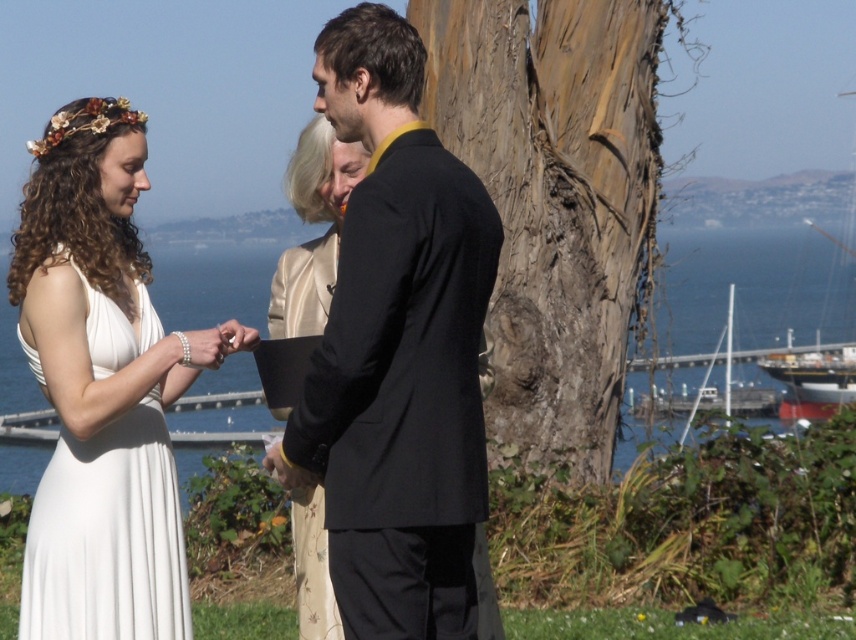
Is white satin dress at left to the right of silky beige dress at center from the viewer's perspective?

No, white satin dress at left is not to the right of silky beige dress at center.

Who is lower down, white satin dress at left or silky beige dress at center?

white satin dress at left is below.

Is point (140, 529) more distant than point (334, 227)?

No, it is in front of (334, 227).

Find the location of a particular element. Image resolution: width=856 pixels, height=640 pixels. white satin dress at left is located at coordinates (107, 536).

Which is in front, point (229, 282) or point (138, 496)?

Positioned in front is point (138, 496).

Which is below, blue water at center or white satin dress at left?

Positioned lower is white satin dress at left.

Measure the distance between point (670, 349) and camera.

Point (670, 349) and camera are 56.88 meters apart from each other.

Locate an element on the screen. The image size is (856, 640). blue water at center is located at coordinates (753, 288).

Who is lower down, white satin dress at center or white satin dress at left?

white satin dress at center is below.

Does white satin dress at center have a larger size compared to white satin dress at left?

No.

Where is `white satin dress at center`? white satin dress at center is located at coordinates (93, 362).